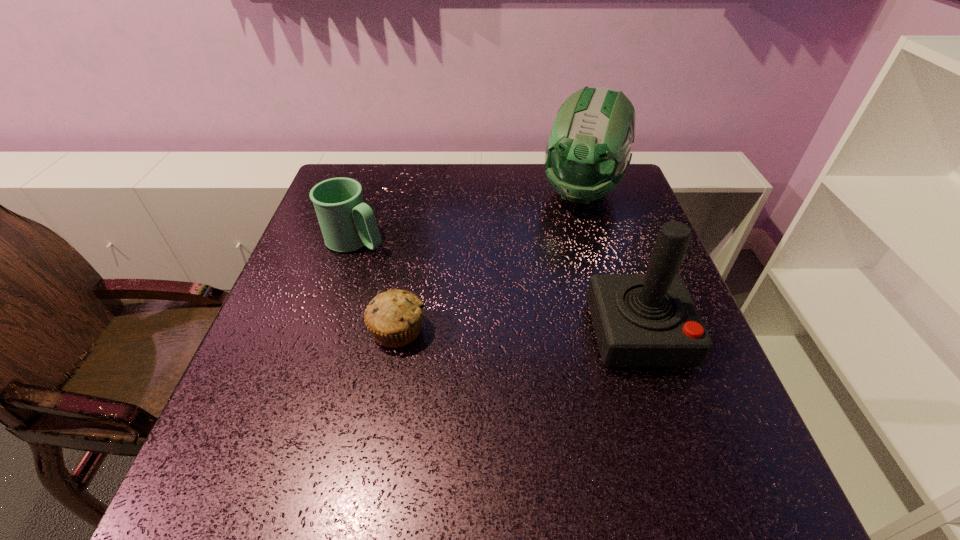
The width and height of the screenshot is (960, 540). Find the location of `vacant space on the desktop that is between the muffin and the joystick and is positioned on the visor of the farthest object`. vacant space on the desktop that is between the muffin and the joystick and is positioned on the visor of the farthest object is located at coordinates (523, 332).

The image size is (960, 540). I want to click on free spot on the desktop that is between the second object from left to right and the joystick and is positioned on the side of the second farthest object with the handle, so click(521, 332).